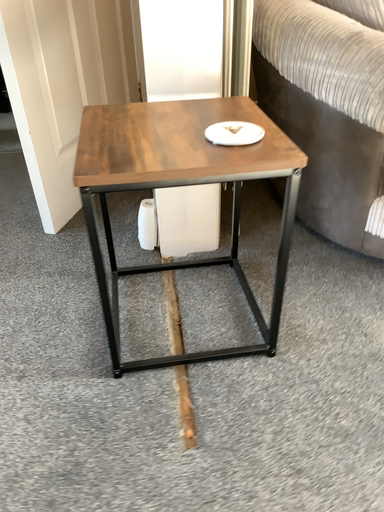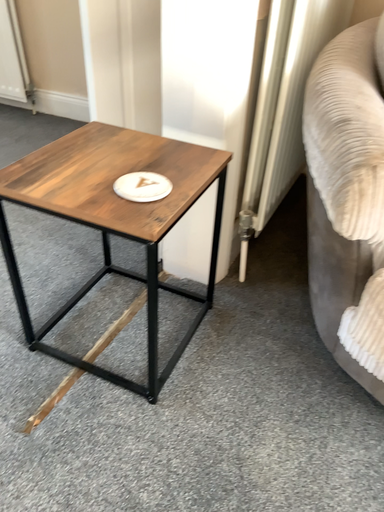
Question: How did the camera likely rotate when shooting the video?

Choices:
 (A) rotated left
 (B) rotated right

Answer: (A)